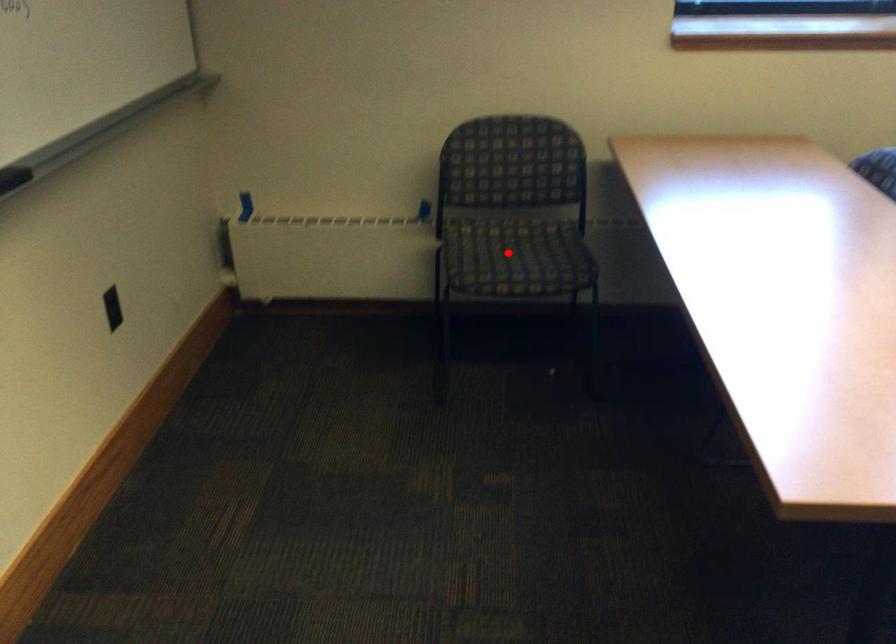
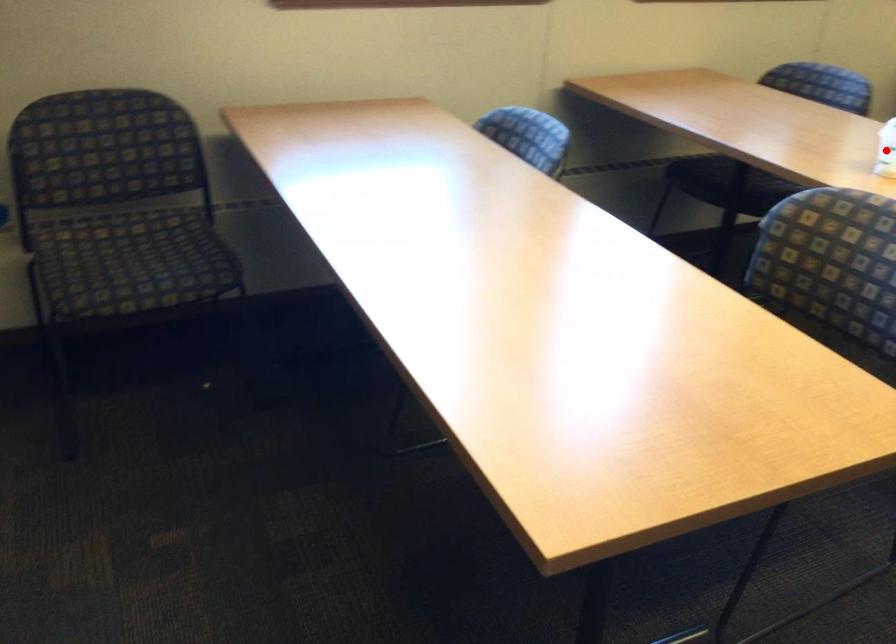
I am providing you with two images of the same scene from different viewpoints. A red point is marked on the first image and another point is marked on the second image. Is the red point in image1 aligned with the point shown in image2?

No